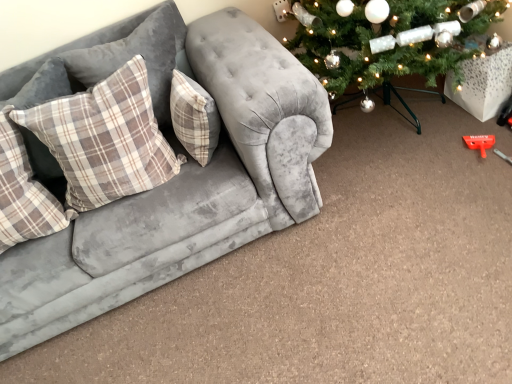
Question: Which direction should I rotate to look at plaid fabric pillow at center, the first pillow in the right-to-left sequence, — up or down?

Choices:
 (A) down
 (B) up

Answer: (B)

Question: Is plaid fabric pillow at left, which appears as the 4th pillow when viewed from the right, looking in the opposite direction of velvet grey couch at left?

Choices:
 (A) yes
 (B) no

Answer: (A)

Question: Considering the relative sizes of plaid fabric pillow at left, which appears as the 4th pillow when viewed from the right, and velvet grey couch at left in the image provided, is plaid fabric pillow at left, which appears as the 4th pillow when viewed from the right, taller than velvet grey couch at left?

Choices:
 (A) no
 (B) yes

Answer: (A)

Question: Considering the relative sizes of plaid fabric pillow at left, which appears as the 4th pillow when viewed from the right, and velvet grey couch at left in the image provided, is plaid fabric pillow at left, which appears as the 4th pillow when viewed from the right, thinner than velvet grey couch at left?

Choices:
 (A) yes
 (B) no

Answer: (A)

Question: Can you confirm if plaid fabric pillow at left, which appears as the 4th pillow when viewed from the right, is wider than velvet grey couch at left?

Choices:
 (A) no
 (B) yes

Answer: (A)

Question: Is plaid fabric pillow at left, which appears as the 4th pillow when viewed from the right, outside velvet grey couch at left?

Choices:
 (A) no
 (B) yes

Answer: (A)

Question: From the image's perspective, is plaid fabric pillow at left, acting as the 1th pillow starting from the left, above velvet grey couch at left?

Choices:
 (A) no
 (B) yes

Answer: (A)

Question: Is velvet grey couch at left completely or partially outside of plaid fabric pillow at center, the first pillow in the right-to-left sequence?

Choices:
 (A) yes
 (B) no

Answer: (A)

Question: From a real-world perspective, is velvet grey couch at left on plaid fabric pillow at center, placed as the 4th pillow when sorted from left to right?

Choices:
 (A) no
 (B) yes

Answer: (A)

Question: From the image's perspective, is velvet grey couch at left under plaid fabric pillow at center, the first pillow in the right-to-left sequence?

Choices:
 (A) yes
 (B) no

Answer: (A)

Question: Considering the relative sizes of velvet grey couch at left and plaid fabric pillow at center, placed as the 4th pillow when sorted from left to right, in the image provided, is velvet grey couch at left shorter than plaid fabric pillow at center, placed as the 4th pillow when sorted from left to right,?

Choices:
 (A) no
 (B) yes

Answer: (A)

Question: Are velvet grey couch at left and plaid fabric pillow at center, placed as the 4th pillow when sorted from left to right, located far from each other?

Choices:
 (A) no
 (B) yes

Answer: (A)

Question: Is the depth of velvet grey couch at left less than that of plaid fabric pillow at center, the first pillow in the right-to-left sequence?

Choices:
 (A) yes
 (B) no

Answer: (A)

Question: Does velvet grey couch at left contain plaid fabric pillow at left, acting as the 1th pillow starting from the left?

Choices:
 (A) yes
 (B) no

Answer: (A)